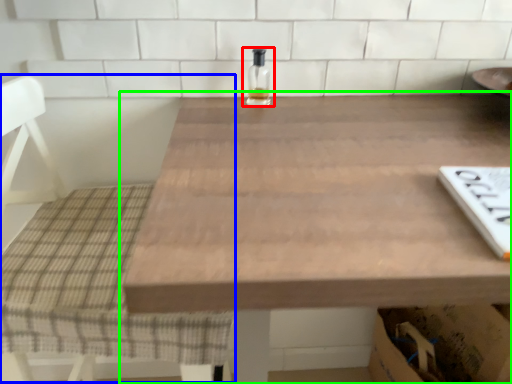
Question: Estimate the real-world distances between objects in this image. Which object is farther from bottle (highlighted by a red box), chair (highlighted by a blue box) or table (highlighted by a green box)?

Choices:
 (A) chair
 (B) table

Answer: (A)